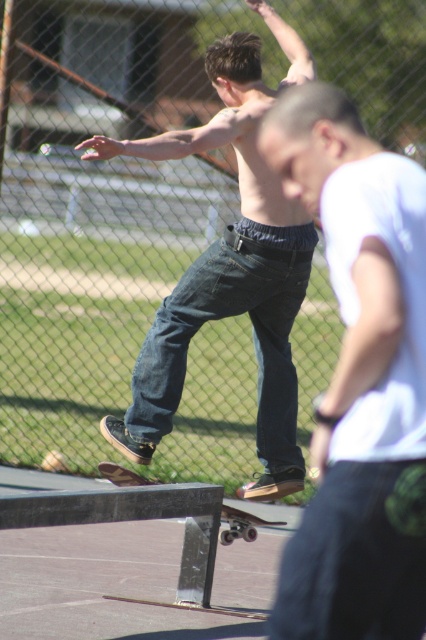
Question: Among these objects, which one is farthest from the camera?

Choices:
 (A) brown leather shoes at center
 (B) wooden skateboard at center
 (C) white matte shirt at center

Answer: (B)

Question: Which is nearer to the white matte shirt at center?

Choices:
 (A) wooden skateboard at center
 (B) brown leather shoes at center

Answer: (B)

Question: Observing the image, what is the correct spatial positioning of white matte shirt at center in reference to wooden skateboard at center?

Choices:
 (A) left
 (B) right

Answer: (B)

Question: Is white matte shirt at center wider than wooden skateboard at center?

Choices:
 (A) no
 (B) yes

Answer: (B)

Question: Which point is closer to the camera taking this photo?

Choices:
 (A) (204, 136)
 (B) (227, 506)
 (C) (299, 150)

Answer: (C)

Question: Does brown leather shoes at center appear on the left side of wooden skateboard at center?

Choices:
 (A) yes
 (B) no

Answer: (A)